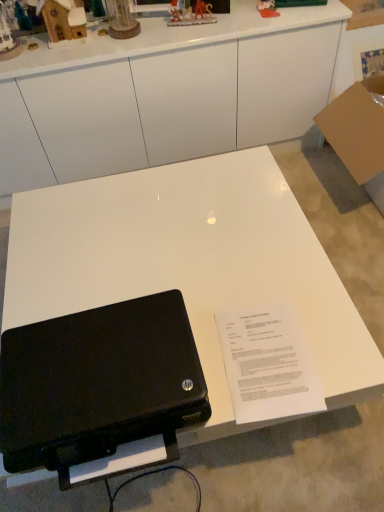
What are the coordinates of `vacant space behind white paper at center` in the screenshot? It's located at (250, 283).